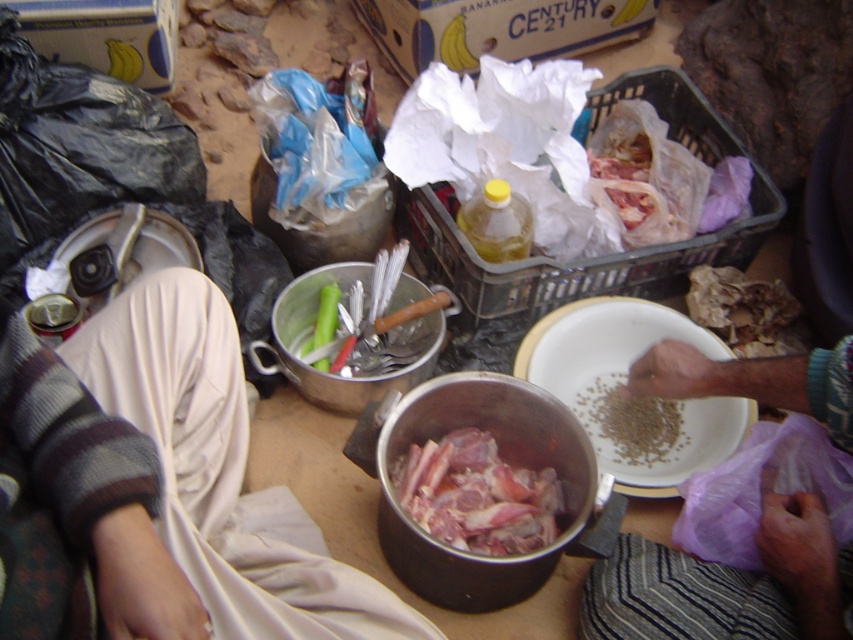
Is smooth purple cloth at lower right to the left of metallic silver pot at center from the viewer's perspective?

Incorrect, smooth purple cloth at lower right is not on the left side of metallic silver pot at center.

Measure the distance between point (x=654, y=552) and camera.

They are 1.21 meters apart.

Locate an element on the screen. The width and height of the screenshot is (853, 640). smooth purple cloth at lower right is located at coordinates (727, 586).

Does metallic silver pot at center have a greater height compared to white matte bowl at center?

Indeed, metallic silver pot at center has a greater height compared to white matte bowl at center.

Is point (379, 467) farther from camera compared to point (560, 381)?

No, it is not.

Locate an element on the screen. The width and height of the screenshot is (853, 640). metallic silver pot at center is located at coordinates (508, 458).

From the picture: Is metallic silver pot at center taller than pinkish raw meat at center?

Indeed, metallic silver pot at center has a greater height compared to pinkish raw meat at center.

Which is above, metallic silver pot at center or pinkish raw meat at center?

metallic silver pot at center is above.

I want to click on metallic silver pot at center, so click(x=508, y=458).

This screenshot has width=853, height=640. In order to click on metallic silver pot at center in this screenshot , I will do `click(508, 458)`.